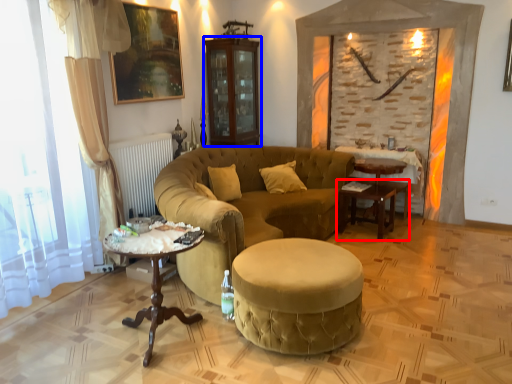
Question: Which object appears closest to the camera in this image, table (highlighted by a red box) or armoire (highlighted by a blue box)?

Choices:
 (A) table
 (B) armoire

Answer: (A)